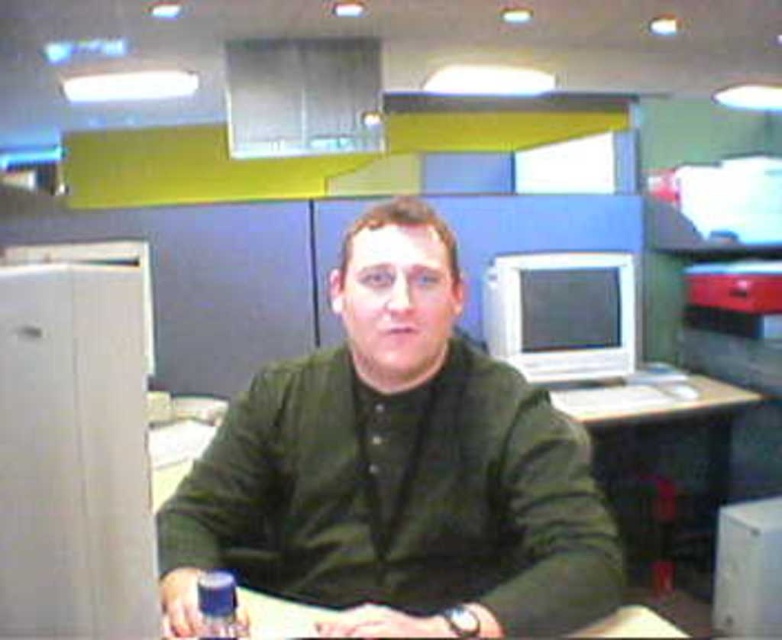
Does dark green shirt at center appear on the left side of blue plastic bottle at lower center?

In fact, dark green shirt at center is to the right of blue plastic bottle at lower center.

What do you see at coordinates (397, 468) in the screenshot?
I see `dark green shirt at center` at bounding box center [397, 468].

Is point (488, 602) in front of point (203, 634)?

No.

The width and height of the screenshot is (782, 640). What are the coordinates of `dark green shirt at center` in the screenshot? It's located at (397, 468).